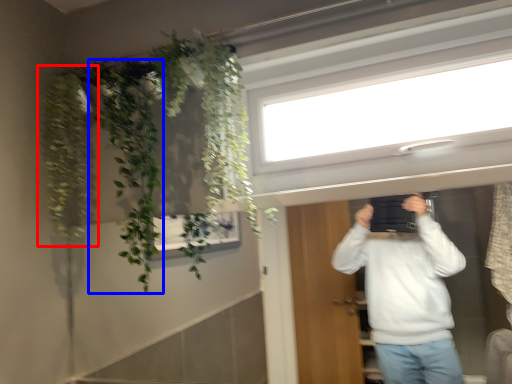
Question: Which object appears closest to the camera in this image, plant (highlighted by a red box) or plant (highlighted by a blue box)?

Choices:
 (A) plant
 (B) plant

Answer: (B)